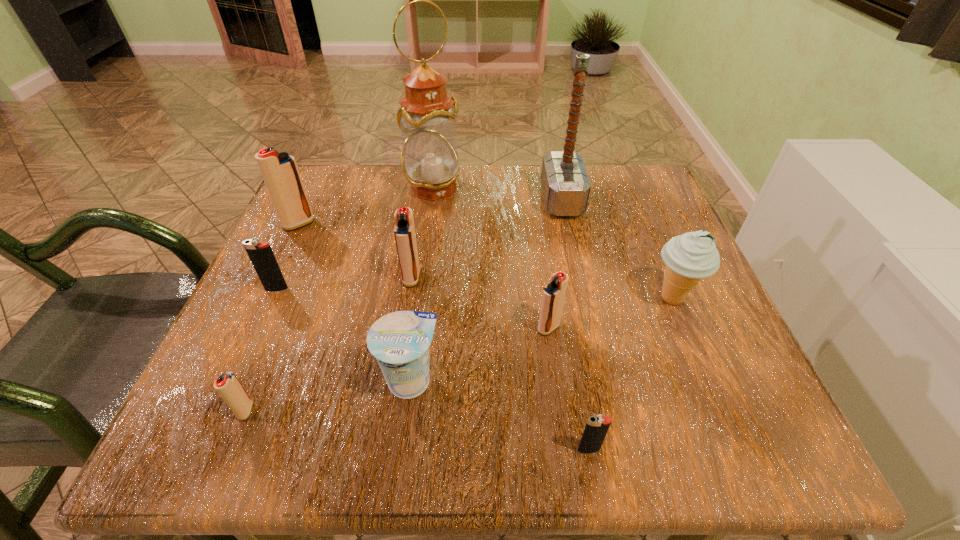
You are a GUI agent. You are given a task and a screenshot of the screen. Output one action in this format:
    pyautogui.click(x=<x>, y=<y>)
    Task: Click on the vacant area that satisfies the following two spatial constraints: 1. on the striking surface of the hammer; 2. on the front side of the farther black igniter
    
    Given the screenshot: What is the action you would take?
    pyautogui.click(x=582, y=289)

You are a GUI agent. You are given a task and a screenshot of the screen. Output one action in this format:
    pyautogui.click(x=<x>, y=<y>)
    Task: Click on the vacant region that satisfies the following two spatial constraints: 1. on the front side of the oil lamp; 2. on the left side of the rightmost object
    
    Given the screenshot: What is the action you would take?
    pyautogui.click(x=419, y=299)

This screenshot has width=960, height=540. Find the location of `free point that satisfies the following two spatial constraints: 1. on the back side of the eighth object from right to left; 2. on the right side of the oil lamp`. free point that satisfies the following two spatial constraints: 1. on the back side of the eighth object from right to left; 2. on the right side of the oil lamp is located at coordinates (337, 188).